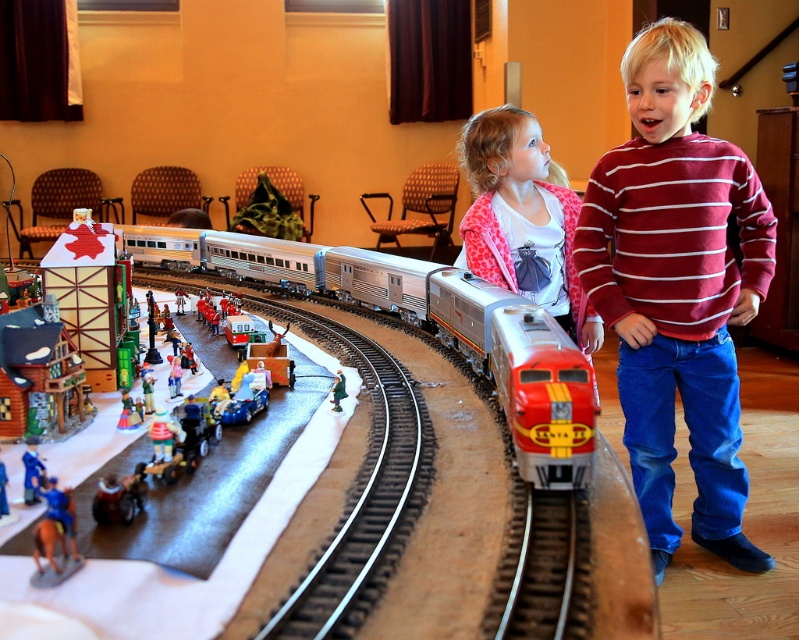
Question: Is striped cotton shirt at right wider than barn wood building at left?

Choices:
 (A) no
 (B) yes

Answer: (B)

Question: Does metallic silver toy car at center have a greater width compared to metallic silver train car at center?

Choices:
 (A) yes
 (B) no

Answer: (A)

Question: Which point is farther to the camera?

Choices:
 (A) (26, 426)
 (B) (565, 208)
 (C) (130, 412)

Answer: (B)

Question: Estimate the real-world distances between objects in this image. Which object is farther from the metallic silver toy car at center?

Choices:
 (A) metallic silver train car at center
 (B) striped cotton shirt at right

Answer: (B)

Question: Which of the following is the farthest from the observer?

Choices:
 (A) (48, 330)
 (B) (535, 634)
 (C) (515, 166)

Answer: (C)

Question: Can you confirm if striped cotton shirt at right is positioned to the left of metallic silver train car at center?

Choices:
 (A) yes
 (B) no

Answer: (B)